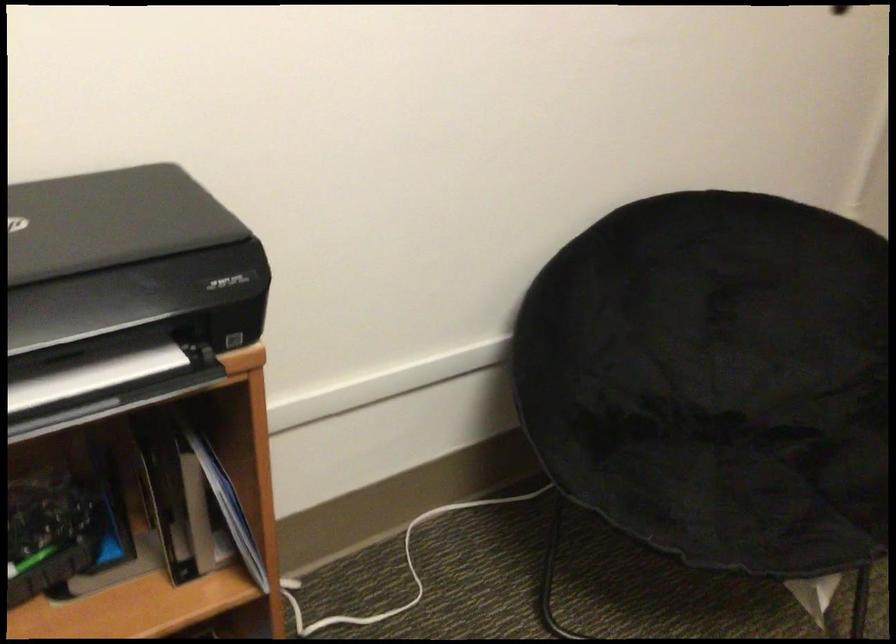
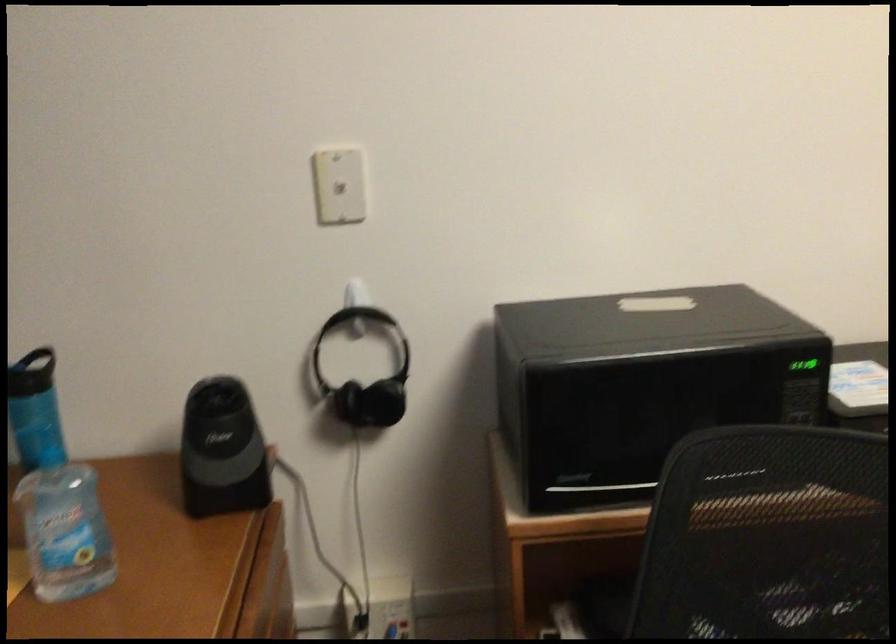
Question: How did the camera likely rotate?

Choices:
 (A) Left
 (B) Right
 (C) Up
 (D) Down

Answer: (A)